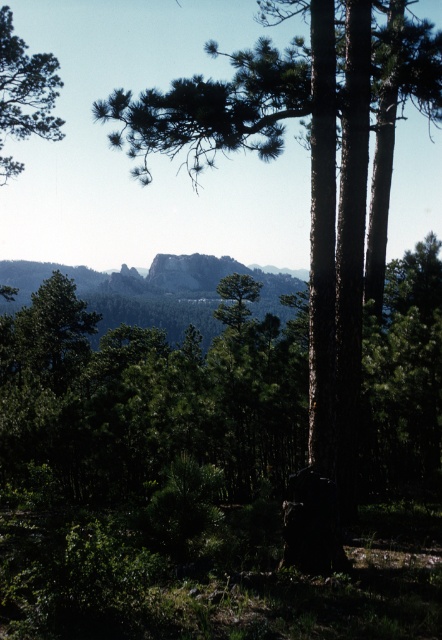
Question: Is the position of green rough bark tree at center more distant than that of green leafy tree at upper left?

Choices:
 (A) yes
 (B) no

Answer: (B)

Question: Which object is farther from the camera taking this photo?

Choices:
 (A) green rough bark tree at center
 (B) green leafy tree at upper left

Answer: (B)

Question: Is green rough bark tree at center closer to the viewer compared to green leafy tree at upper left?

Choices:
 (A) no
 (B) yes

Answer: (B)

Question: Which point is farther to the camera?

Choices:
 (A) (217, 134)
 (B) (0, 170)

Answer: (B)

Question: Can you confirm if green rough bark tree at center is positioned above green leafy tree at upper left?

Choices:
 (A) yes
 (B) no

Answer: (A)